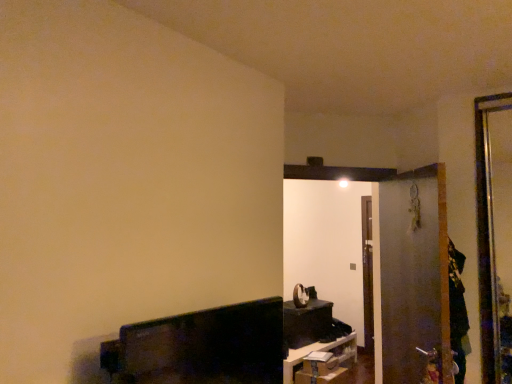
Question: Does transparent plastic screen door at right have a smaller size compared to matte black shelf at lower center, which is the first furniture from bottom to top?

Choices:
 (A) yes
 (B) no

Answer: (A)

Question: Can you confirm if transparent plastic screen door at right is thinner than matte black shelf at lower center, which is the first furniture from bottom to top?

Choices:
 (A) no
 (B) yes

Answer: (B)

Question: Can you confirm if transparent plastic screen door at right is bigger than matte black shelf at lower center, which appears as the 3th furniture when viewed from the top?

Choices:
 (A) no
 (B) yes

Answer: (A)

Question: Does transparent plastic screen door at right appear on the left side of matte black shelf at lower center, arranged as the 2th furniture when viewed from the back?

Choices:
 (A) yes
 (B) no

Answer: (B)

Question: Is transparent plastic screen door at right far from matte black shelf at lower center, arranged as the 2th furniture when viewed from the back?

Choices:
 (A) yes
 (B) no

Answer: (A)

Question: In the image, is transparent plastic screen door at right on the left side or the right side of matte black clock at center, which appears as the 1th furniture when viewed from the back?

Choices:
 (A) left
 (B) right

Answer: (B)

Question: Would you say transparent plastic screen door at right is inside or outside matte black clock at center, which appears as the 1th furniture when viewed from the back?

Choices:
 (A) outside
 (B) inside

Answer: (A)

Question: In terms of size, does transparent plastic screen door at right appear bigger or smaller than matte black clock at center, which is the second furniture in bottom-to-top order?

Choices:
 (A) big
 (B) small

Answer: (A)

Question: Looking at their shapes, would you say transparent plastic screen door at right is wider or thinner than matte black clock at center, which appears as the 1th furniture when viewed from the back?

Choices:
 (A) thin
 (B) wide

Answer: (A)

Question: Is matte black tv at lower left, the first furniture viewed from the front, in front of or behind matte black clock at center, which appears as the 1th furniture when viewed from the back, in the image?

Choices:
 (A) front
 (B) behind

Answer: (A)

Question: Considering the positions of matte black tv at lower left, which appears as the 1th furniture when viewed from the top, and matte black clock at center, which is the second furniture in bottom-to-top order, in the image, is matte black tv at lower left, which appears as the 1th furniture when viewed from the top, taller or shorter than matte black clock at center, which is the second furniture in bottom-to-top order,?

Choices:
 (A) short
 (B) tall

Answer: (A)

Question: From the image's perspective, is matte black tv at lower left, which is counted as the 3th furniture, starting from the bottom, positioned above or below matte black clock at center, the 3th furniture in the front-to-back sequence?

Choices:
 (A) above
 (B) below

Answer: (A)

Question: Choose the correct answer: Is matte black tv at lower left, which is counted as the 3th furniture, starting from the bottom, inside matte black clock at center, which is the second furniture in bottom-to-top order, or outside it?

Choices:
 (A) inside
 (B) outside

Answer: (B)

Question: In the image, is transparent plastic screen door at right on the left side or the right side of matte black shelf at lower center, arranged as the 2th furniture when viewed from the back?

Choices:
 (A) right
 (B) left

Answer: (A)

Question: Looking at their shapes, would you say transparent plastic screen door at right is wider or thinner than matte black shelf at lower center, which is the first furniture from bottom to top?

Choices:
 (A) thin
 (B) wide

Answer: (A)